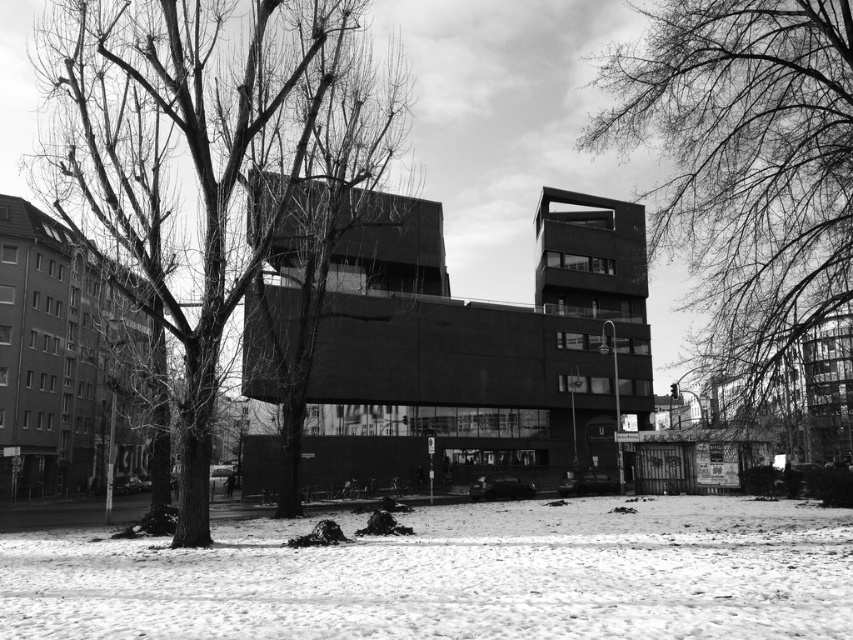
Is the position of smooth bark tree at center less distant than that of bare branches at upper right?

No, smooth bark tree at center is behind bare branches at upper right.

Is point (138, 84) positioned in front of point (610, 118)?

Yes.

What do you see at coordinates (206, 156) in the screenshot? Image resolution: width=853 pixels, height=640 pixels. I see `smooth bark tree at center` at bounding box center [206, 156].

This screenshot has height=640, width=853. In order to click on smooth bark tree at center in this screenshot , I will do `click(206, 156)`.

Can you confirm if bare branches at upper right is positioned below bare branches at center?

Yes, bare branches at upper right is below bare branches at center.

Is point (733, 339) less distant than point (366, 161)?

Yes.

The height and width of the screenshot is (640, 853). Identify the location of bare branches at upper right. (746, 164).

Can you confirm if white powdery snow at lower center is wider than bare branches at center?

Correct, the width of white powdery snow at lower center exceeds that of bare branches at center.

Is white powdery snow at lower center to the left of bare branches at center from the viewer's perspective?

No, white powdery snow at lower center is not to the left of bare branches at center.

Find the location of `white powdery snow at lower center`. white powdery snow at lower center is located at coordinates (456, 577).

Find the location of a particular element. The width and height of the screenshot is (853, 640). white powdery snow at lower center is located at coordinates (456, 577).